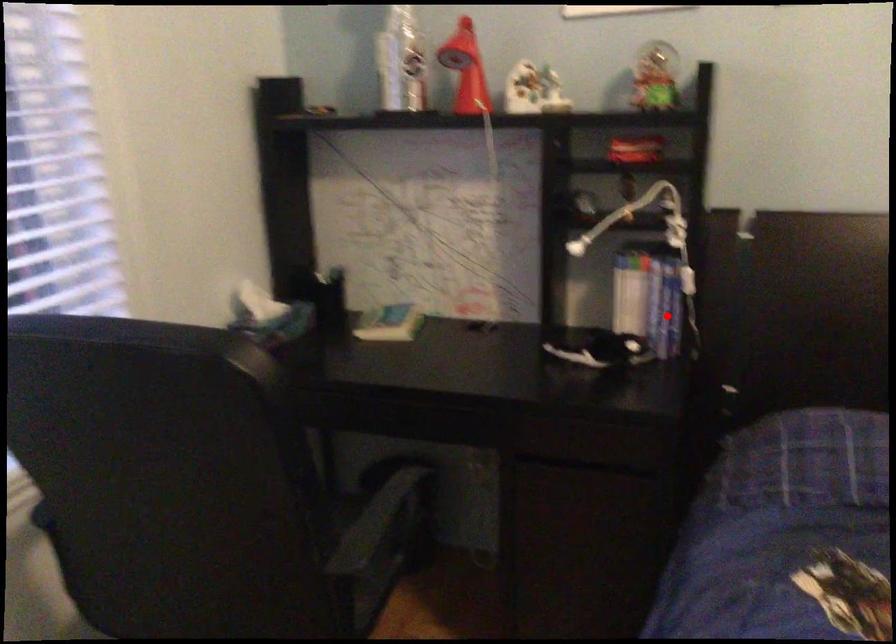
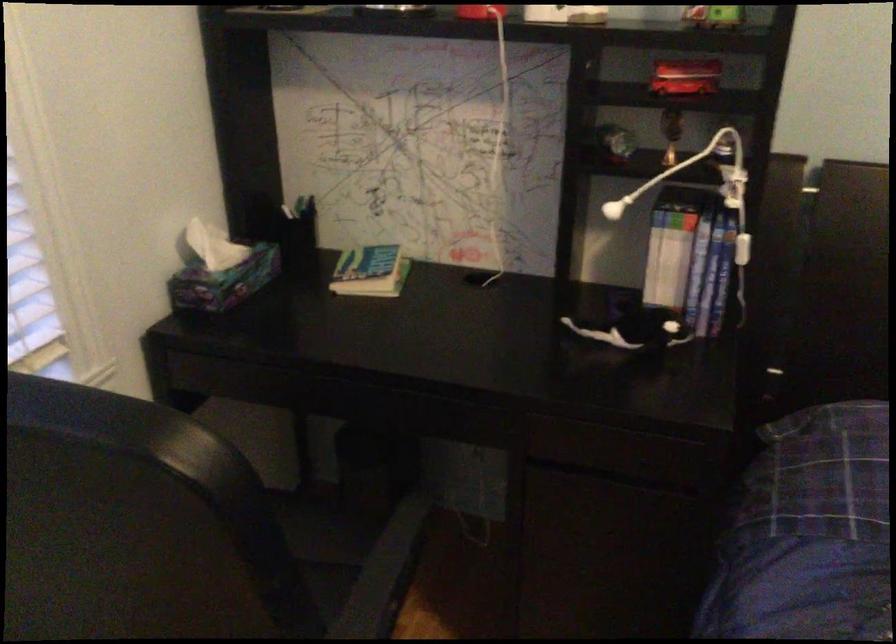
Question: I am providing you with two images of the same scene from different viewpoints. Image1 has a red point marked. In image2, the corresponding 3D location appears at what relative position? Reply with the corresponding letter.

Choices:
 (A) Closer
 (B) Farther

Answer: (A)